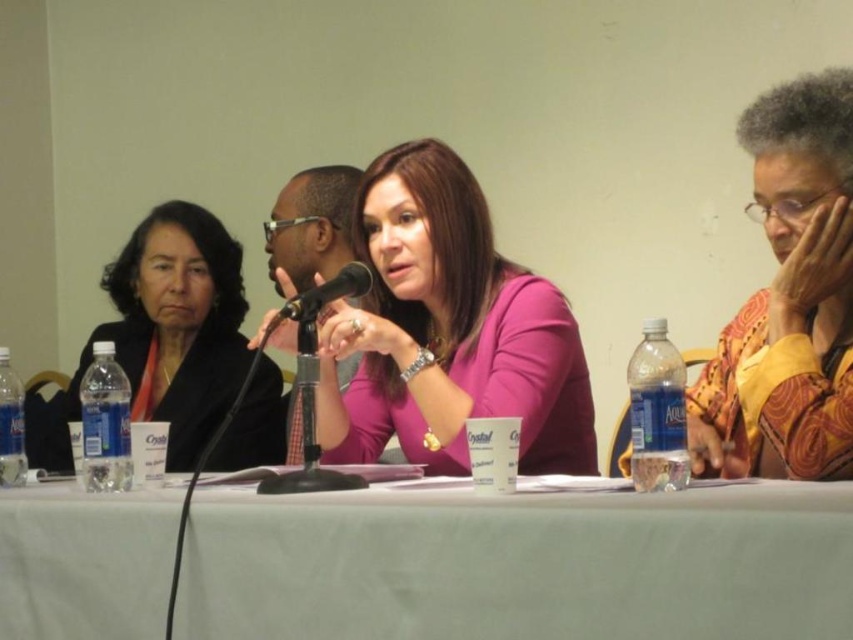
From the picture: What is located at the coordinates point (170, 330) in the scene?

The matte black jacket at left is located at point (170, 330).

What is the object located at the coordinate point (521,564) in the image?

The object located at the coordinate point (521,564) is the white fabric table at center.

You are organizing a small event and need to place a 1.2 meter wide banner on the table. The banner must be placed in front of the black metallic microphone at center. Will the white fabric table at center have enough space for the banner?

The white fabric table at center has a larger width than the black metallic microphone at center, so it can accommodate the 1.2 meter wide banner placed in front of the microphone.